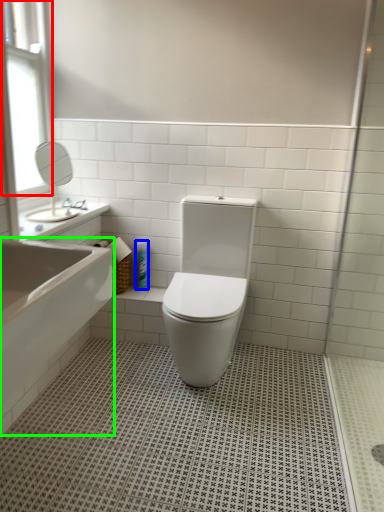
Question: Which object is positioned farthest from window (highlighted by a red box)? Select from toiletry (highlighted by a blue box) and bath (highlighted by a green box).

Choices:
 (A) toiletry
 (B) bath

Answer: (B)